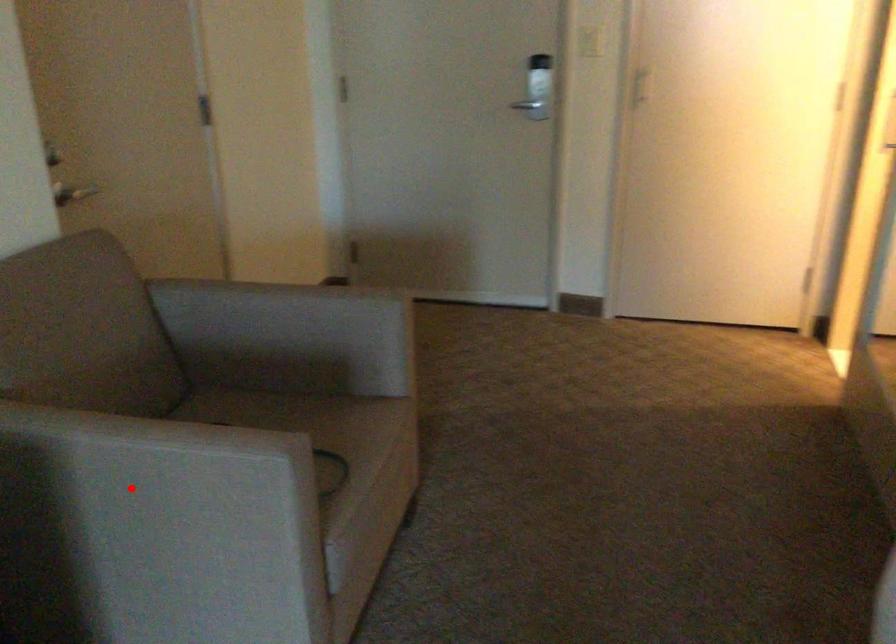
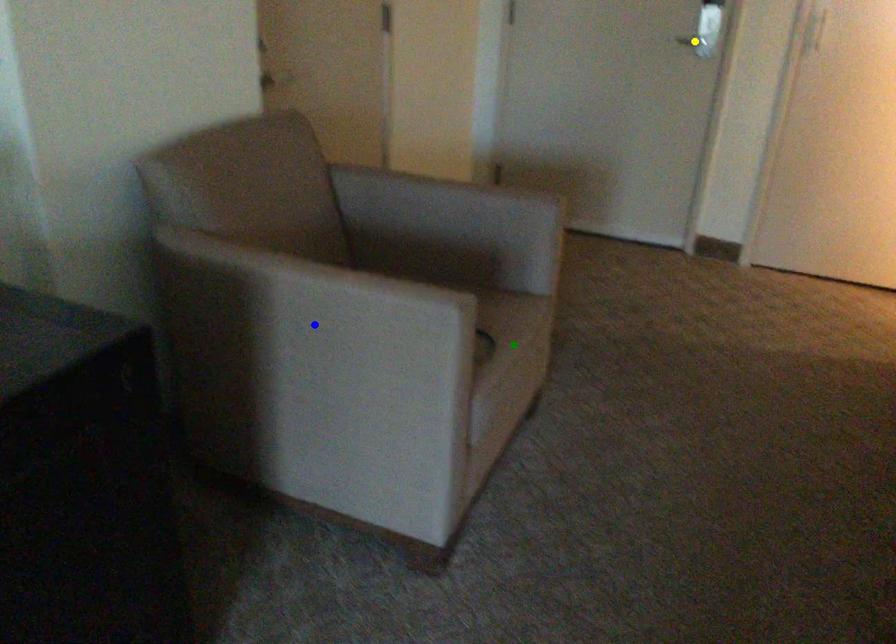
Question: I am providing you with two images of the same scene from different viewpoints. A red point is marked on the first image. You are given multiple points on the second image. Which spot in image 2 lines up with the point in image 1?

Choices:
 (A) green point
 (B) blue point
 (C) yellow point

Answer: (B)